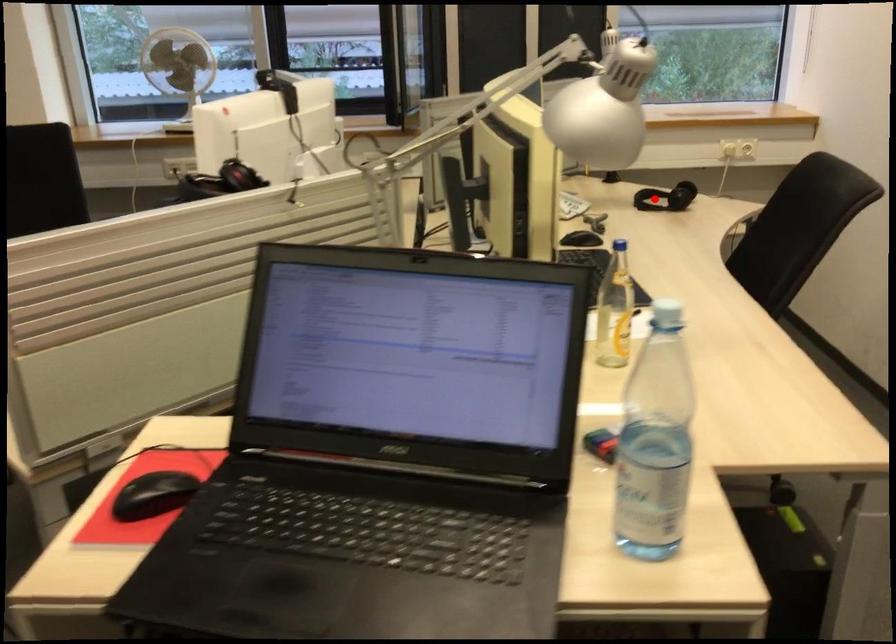
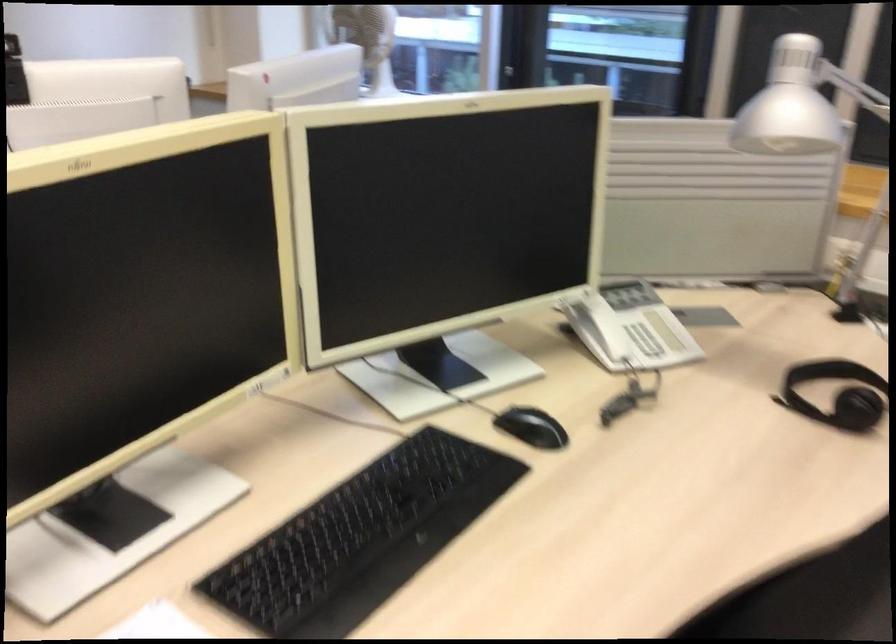
Find the pixel in the second image that matches the highlighted location in the first image.

(837, 393)